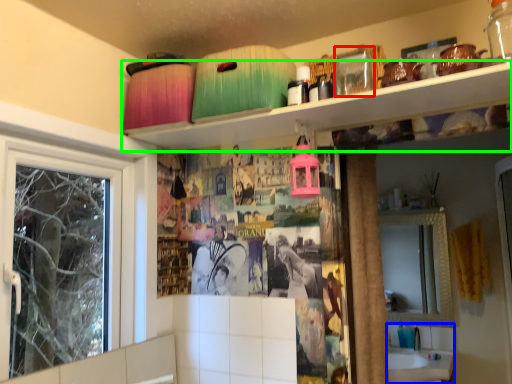
Question: Considering the real-world distances, which object is farthest from glass jar (highlighted by a red box)? sink (highlighted by a blue box) or shelf (highlighted by a green box)?

Choices:
 (A) sink
 (B) shelf

Answer: (A)